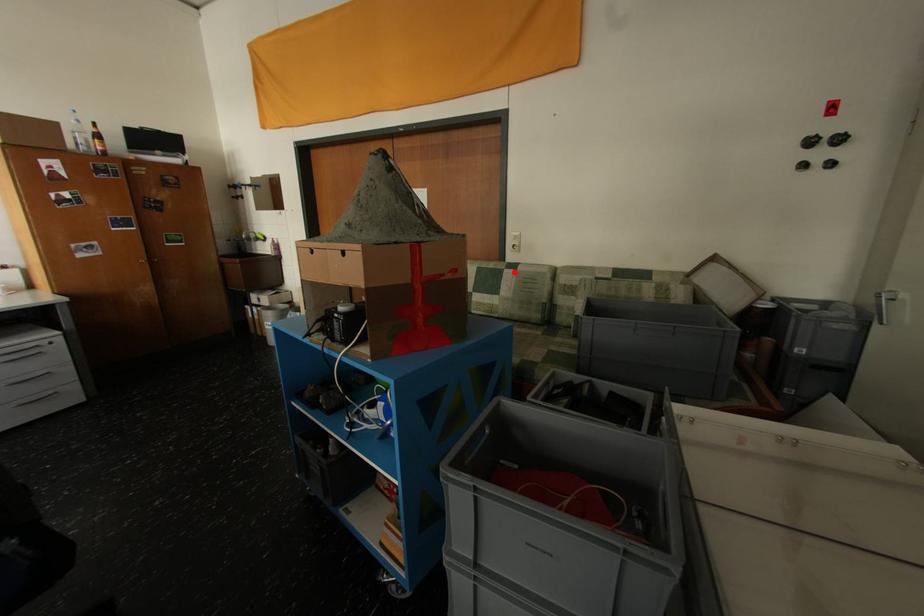
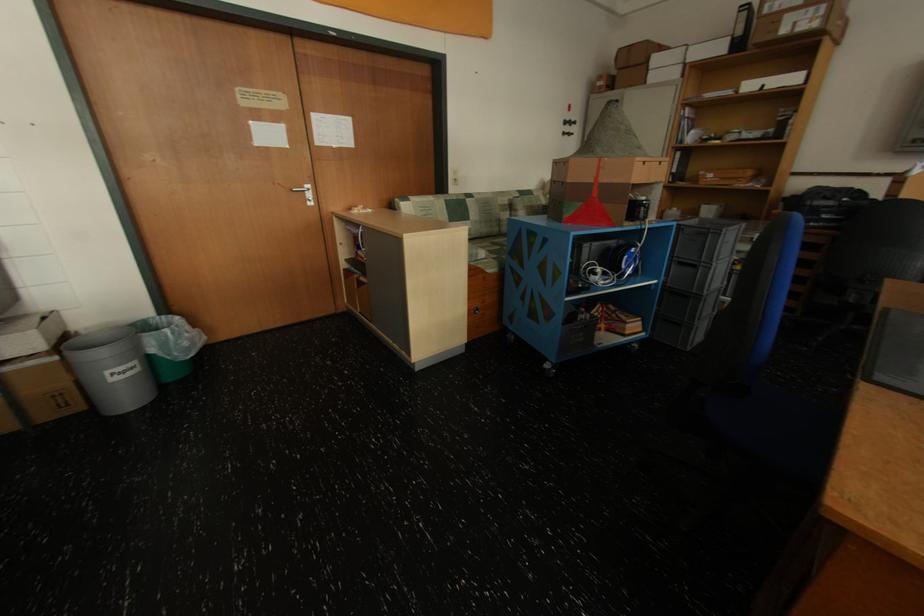
In the second image, find the point that corresponds to the highlighted location in the first image.

(476, 201)